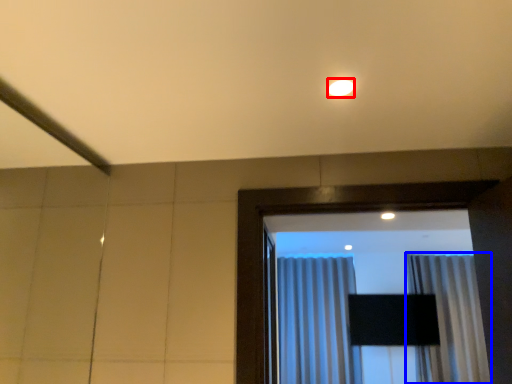
Question: Which object is closer to the camera taking this photo, lighting (highlighted by a red box) or curtain (highlighted by a blue box)?

Choices:
 (A) lighting
 (B) curtain

Answer: (A)